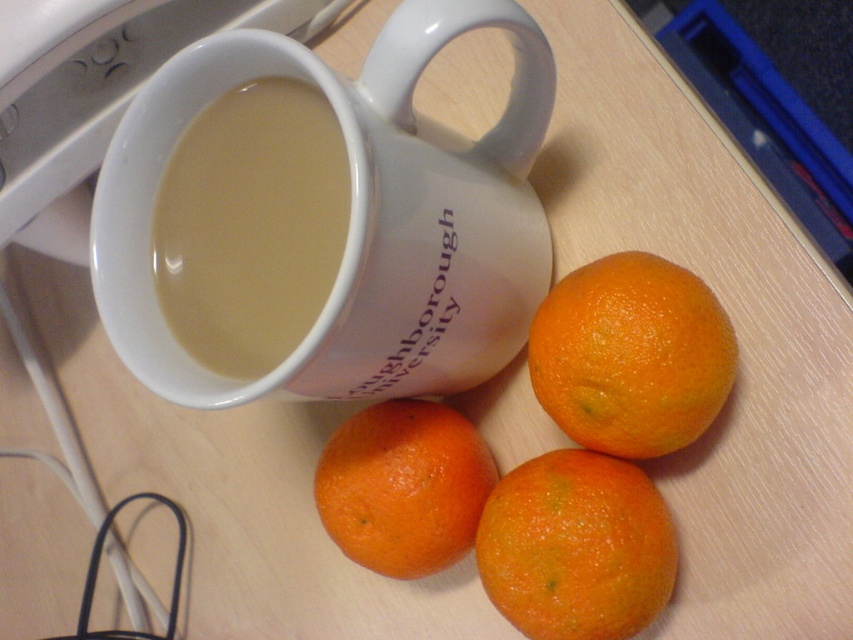
Question: Which object is positioned farthest from the white ceramic mug at upper center?

Choices:
 (A) orangesmoothorange at lower center
 (B) orange matte at center

Answer: (B)

Question: Can you confirm if matte ceramic mug at upper center is smaller than orange matte at center?

Choices:
 (A) yes
 (B) no

Answer: (B)

Question: Among these objects, which one is farthest from the camera?

Choices:
 (A) orange matte at center
 (B) white ceramic mug at upper center
 (C) orange matte/orange at center

Answer: (A)

Question: Can you confirm if matte ceramic mug at upper center is positioned to the right of orange matte at center?

Choices:
 (A) no
 (B) yes

Answer: (A)

Question: Is orange matte at center positioned in front of orangesmoothorange at lower center?

Choices:
 (A) yes
 (B) no

Answer: (A)

Question: Which of these objects is positioned farthest from the orangesmoothorange at lower center?

Choices:
 (A) white ceramic mug at upper center
 (B) orange matte at center

Answer: (A)